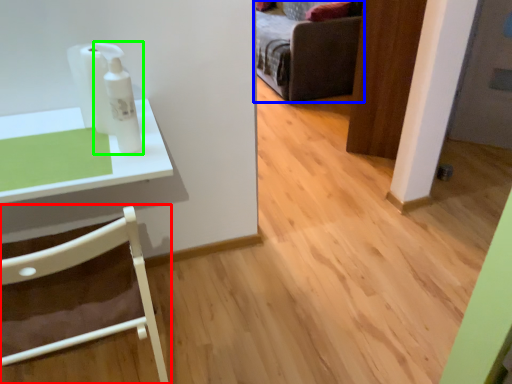
Question: Which is nearer to the chair (highlighted by a red box)? furniture (highlighted by a blue box) or toiletry (highlighted by a green box).

Choices:
 (A) furniture
 (B) toiletry

Answer: (B)